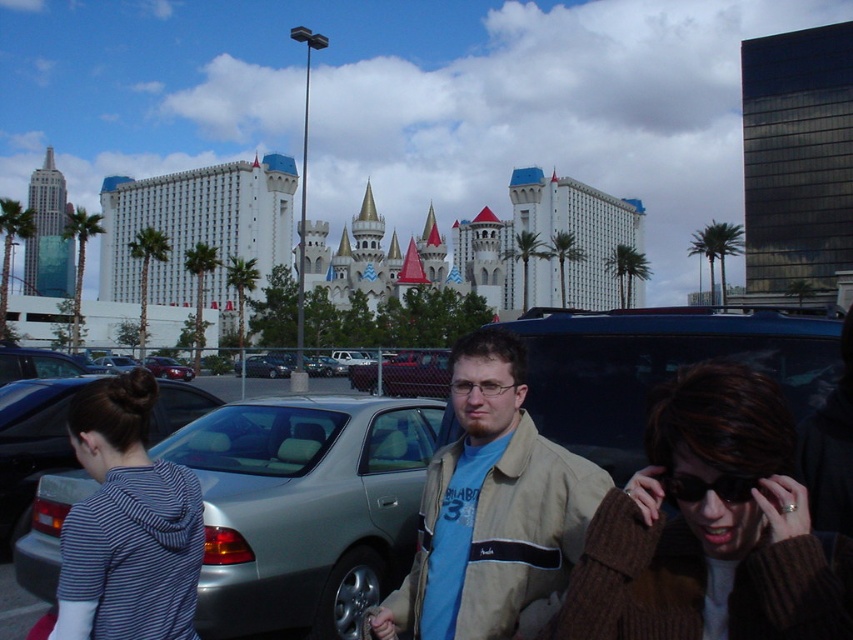
You are standing at the point marked as point (262, 365). Which car is exactly at your current location?

The metallic silver sedan at center is located at point (262, 365).

You are a tourist in this parking lot and want to pick up your belongings. You have a brown knitted sweater at lower right and a beige jacket at center. Which item is closer to the ground?

The brown knitted sweater at lower right is below the beige jacket at center, so it is closer to the ground.